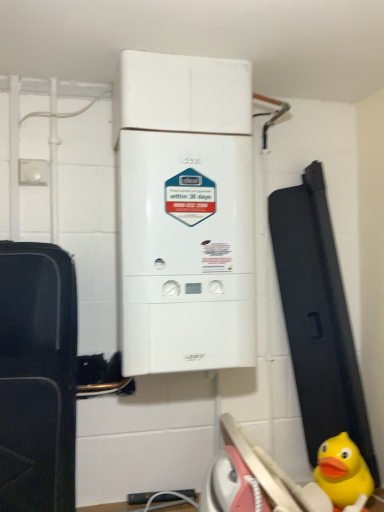
Question: Is white matte boiler at center spatially inside yellow rubber duck at lower right, or outside of it?

Choices:
 (A) inside
 (B) outside

Answer: (B)

Question: Considering the positions of point (246, 240) and point (322, 482), is point (246, 240) closer or farther from the camera than point (322, 482)?

Choices:
 (A) farther
 (B) closer

Answer: (A)

Question: From a real-world perspective, relative to yellow rubber duck at lower right, is white matte boiler at center vertically above or below?

Choices:
 (A) below
 (B) above

Answer: (B)

Question: From a real-world perspective, is yellow rubber duck at lower right positioned above or below white matte boiler at center?

Choices:
 (A) below
 (B) above

Answer: (A)

Question: Is yellow rubber duck at lower right in front of or behind white matte boiler at center in the image?

Choices:
 (A) front
 (B) behind

Answer: (B)

Question: Is yellow rubber duck at lower right taller or shorter than white matte boiler at center?

Choices:
 (A) tall
 (B) short

Answer: (B)

Question: Does point (337, 496) appear closer or farther from the camera than point (165, 228)?

Choices:
 (A) farther
 (B) closer

Answer: (A)